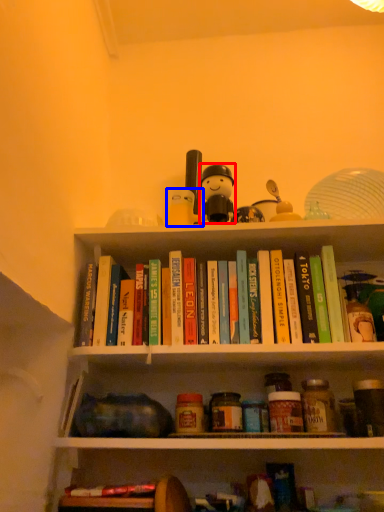
Question: Which object appears farthest to the camera in this image, figurine (highlighted by a red box) or toy (highlighted by a blue box)?

Choices:
 (A) figurine
 (B) toy

Answer: (B)